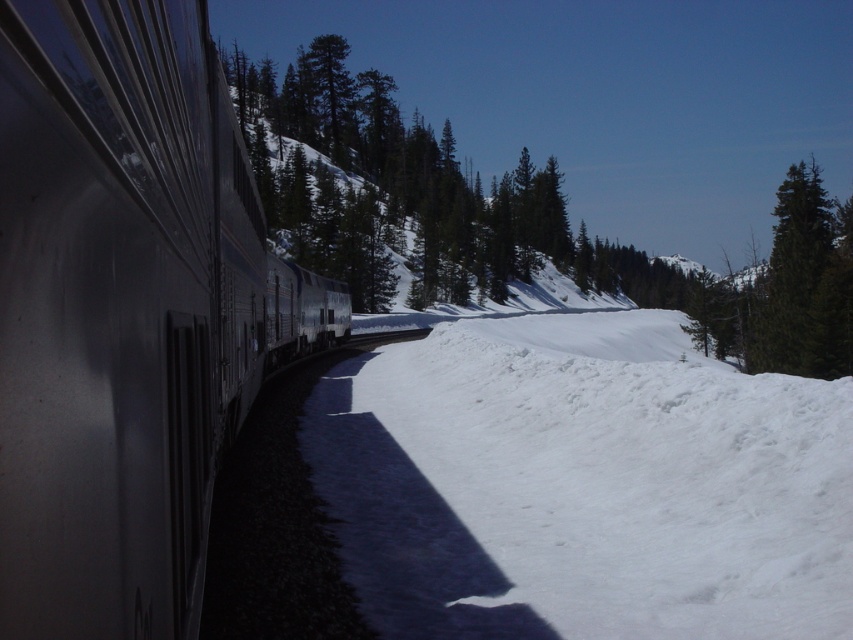
I want to click on white fluffy snow at lower right, so click(584, 484).

This screenshot has width=853, height=640. I want to click on white fluffy snow at lower right, so click(x=584, y=484).

Between white fluffy snow at lower right and green matte tree at upper right, which one appears on the right side from the viewer's perspective?

green matte tree at upper right is more to the right.

Can you confirm if white fluffy snow at lower right is shorter than green matte tree at upper right?

Yes, white fluffy snow at lower right is shorter than green matte tree at upper right.

Is point (527, 396) closer to camera compared to point (782, 218)?

Yes, point (527, 396) is closer to viewer.

Identify the location of white fluffy snow at lower right. (584, 484).

How distant is metallic silver train at left from green matte tree at upper right?

They are 163.73 feet apart.

Between metallic silver train at left and green matte tree at upper right, which one has more height?

Standing taller between the two is green matte tree at upper right.

Is point (131, 628) behind point (798, 365)?

No, (131, 628) is in front of (798, 365).

Where is `metallic silver train at left`? This screenshot has width=853, height=640. metallic silver train at left is located at coordinates [120, 310].